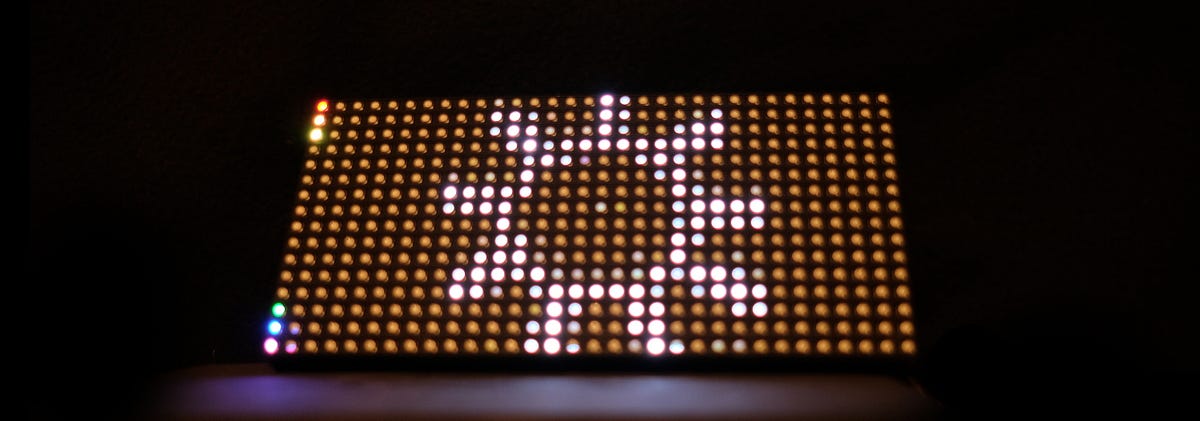
Where is `lighting`? This screenshot has height=421, width=1200. lighting is located at coordinates (274, 330), (316, 129), (480, 198).